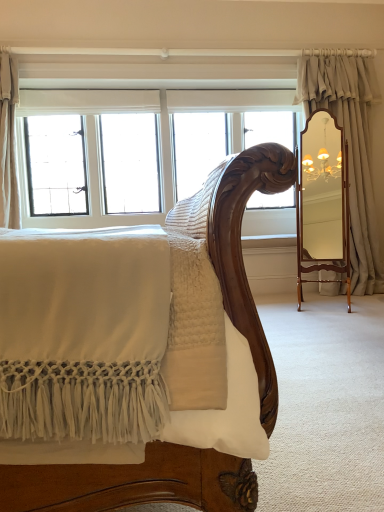
Question: Is white glass window at upper left at the right side of satin beige curtain at right, marked as the first curtain in a right-to-left arrangement?

Choices:
 (A) yes
 (B) no

Answer: (B)

Question: Is white glass window at upper left next to satin beige curtain at right, placed as the second curtain when sorted from left to right?

Choices:
 (A) yes
 (B) no

Answer: (B)

Question: Considering the relative sizes of white glass window at upper left and satin beige curtain at right, placed as the second curtain when sorted from left to right, in the image provided, is white glass window at upper left taller than satin beige curtain at right, placed as the second curtain when sorted from left to right,?

Choices:
 (A) yes
 (B) no

Answer: (B)

Question: Can you confirm if white glass window at upper left is thinner than satin beige curtain at right, marked as the first curtain in a right-to-left arrangement?

Choices:
 (A) yes
 (B) no

Answer: (A)

Question: Does white glass window at upper left turn towards satin beige curtain at right, placed as the second curtain when sorted from left to right?

Choices:
 (A) no
 (B) yes

Answer: (A)

Question: Is white glass window at upper left bigger than satin beige curtain at right, marked as the first curtain in a right-to-left arrangement?

Choices:
 (A) yes
 (B) no

Answer: (A)

Question: Is beige linen curtain at upper left, which is the 1th curtain in left-to-right order, at the left side of satin beige curtain at right, placed as the second curtain when sorted from left to right?

Choices:
 (A) no
 (B) yes

Answer: (B)

Question: Considering the relative sizes of beige linen curtain at upper left, which is the 1th curtain in left-to-right order, and satin beige curtain at right, marked as the first curtain in a right-to-left arrangement, in the image provided, is beige linen curtain at upper left, which is the 1th curtain in left-to-right order, shorter than satin beige curtain at right, marked as the first curtain in a right-to-left arrangement,?

Choices:
 (A) no
 (B) yes

Answer: (B)

Question: Is beige linen curtain at upper left, which is the 1th curtain in left-to-right order, with satin beige curtain at right, placed as the second curtain when sorted from left to right?

Choices:
 (A) no
 (B) yes

Answer: (A)

Question: From a real-world perspective, is beige linen curtain at upper left, which is counted as the 2th curtain, starting from the right, under satin beige curtain at right, marked as the first curtain in a right-to-left arrangement?

Choices:
 (A) yes
 (B) no

Answer: (B)

Question: Considering the relative sizes of beige linen curtain at upper left, which is counted as the 2th curtain, starting from the right, and satin beige curtain at right, placed as the second curtain when sorted from left to right, in the image provided, is beige linen curtain at upper left, which is counted as the 2th curtain, starting from the right, smaller than satin beige curtain at right, placed as the second curtain when sorted from left to right,?

Choices:
 (A) yes
 (B) no

Answer: (A)

Question: From the image's perspective, is beige linen curtain at upper left, which is counted as the 2th curtain, starting from the right, under satin beige curtain at right, marked as the first curtain in a right-to-left arrangement?

Choices:
 (A) yes
 (B) no

Answer: (B)

Question: Is white glass window at upper left taller than beige linen curtain at upper left, which is the 1th curtain in left-to-right order?

Choices:
 (A) no
 (B) yes

Answer: (B)